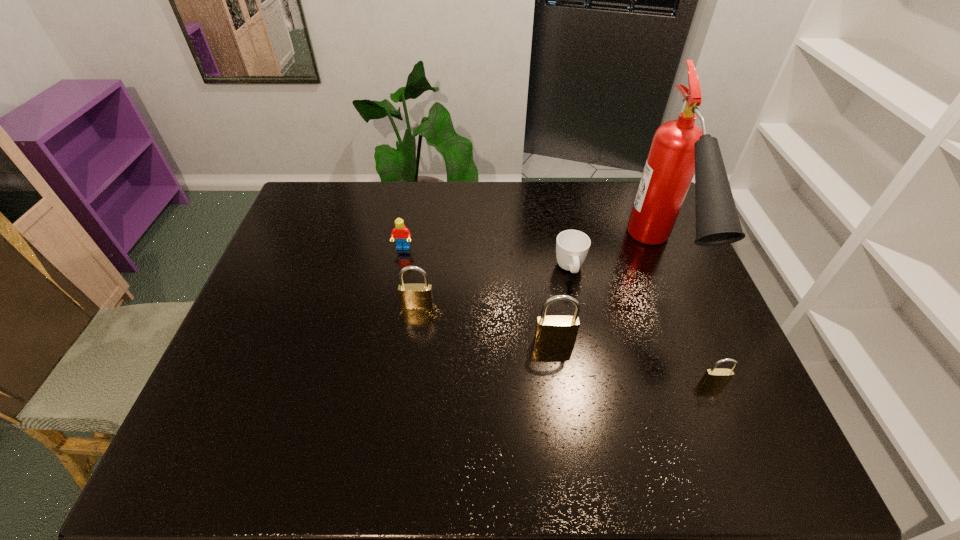
At what (x,y) coordinates should I click in order to perform the action: click on object that is positioned at the near right corner. Please return your answer as a coordinate pair (x, y). Image resolution: width=960 pixels, height=540 pixels. Looking at the image, I should click on (713, 377).

In the image, there is a desktop. Where is `vacant region at the far edge`? The image size is (960, 540). vacant region at the far edge is located at coordinates (378, 199).

Where is `vacant area at the near edge of the desktop`? vacant area at the near edge of the desktop is located at coordinates (348, 410).

In order to click on free region at the left edge in this screenshot , I will do `click(241, 359)`.

I want to click on vacant space at the right edge, so click(x=673, y=288).

This screenshot has height=540, width=960. What are the coordinates of `vacant position at the far left corner of the desktop` in the screenshot? It's located at [300, 219].

This screenshot has height=540, width=960. In the image, there is a desktop. Identify the location of vacant space at the far right corner. (623, 195).

Where is `vacant space that is in between the second shortest padlock and the second farthest padlock`? vacant space that is in between the second shortest padlock and the second farthest padlock is located at coordinates (486, 323).

Locate an element on the screen. The height and width of the screenshot is (540, 960). empty location between the leftmost padlock and the cup is located at coordinates (493, 287).

At what (x,y) coordinates should I click in order to perform the action: click on free point between the fifth farthest object and the rightmost padlock. Please return your answer as a coordinate pair (x, y). Looking at the image, I should click on [x=634, y=362].